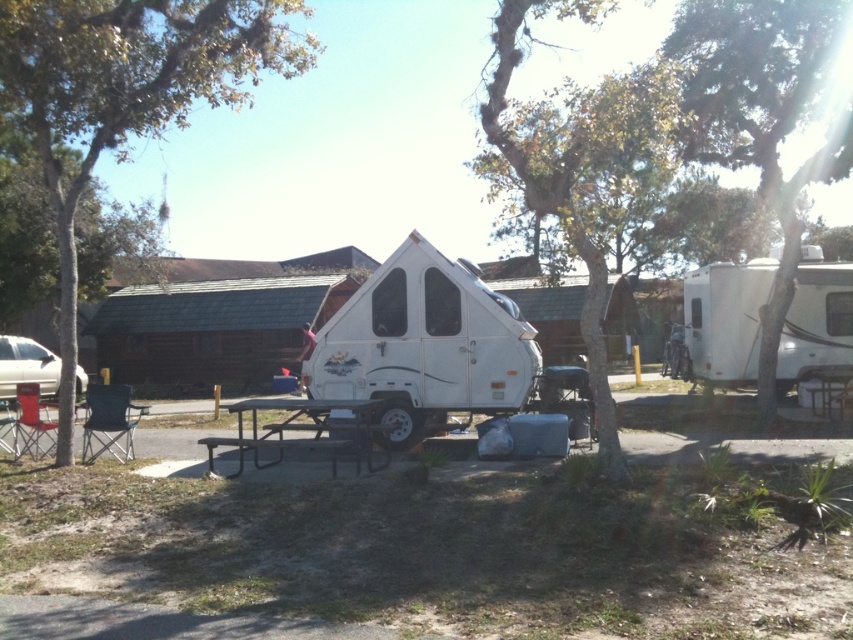
Measure the distance between white glossy camper at right and camera.

They are 12.78 meters apart.

Identify the location of white glossy camper at right. The width and height of the screenshot is (853, 640). (724, 320).

Does point (788, 342) come farther from viewer compared to point (346, 404)?

Yes, it is behind point (346, 404).

You are a GUI agent. You are given a task and a screenshot of the screen. Output one action in this format:
    pyautogui.click(x=<x>, y=<y>)
    Task: Click on the white glossy camper at right
    The width and height of the screenshot is (853, 640).
    Given the screenshot: What is the action you would take?
    pyautogui.click(x=724, y=320)

Is point (53, 4) farther from viewer compared to point (375, 424)?

That is False.

Which of these two, green leafy tree at left or metallic silver picnic table at center, stands shorter?

Standing shorter between the two is metallic silver picnic table at center.

Describe the element at coordinates (126, 93) in the screenshot. The height and width of the screenshot is (640, 853). I see `green leafy tree at left` at that location.

The image size is (853, 640). I want to click on green leafy tree at left, so click(126, 93).

Is green leafy tree at center taller than white matte camper at center?

Yes.

The height and width of the screenshot is (640, 853). Describe the element at coordinates (764, 115) in the screenshot. I see `green leafy tree at center` at that location.

Which is in front, point (685, 12) or point (357, 342)?

Point (357, 342)

Locate an element on the screen. The image size is (853, 640). green leafy tree at center is located at coordinates (764, 115).